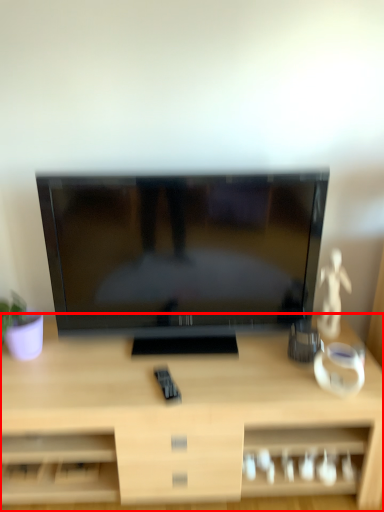
Question: From the image, what is the correct spatial relationship of desk (annotated by the red box) in relation to television?

Choices:
 (A) right
 (B) left

Answer: (B)